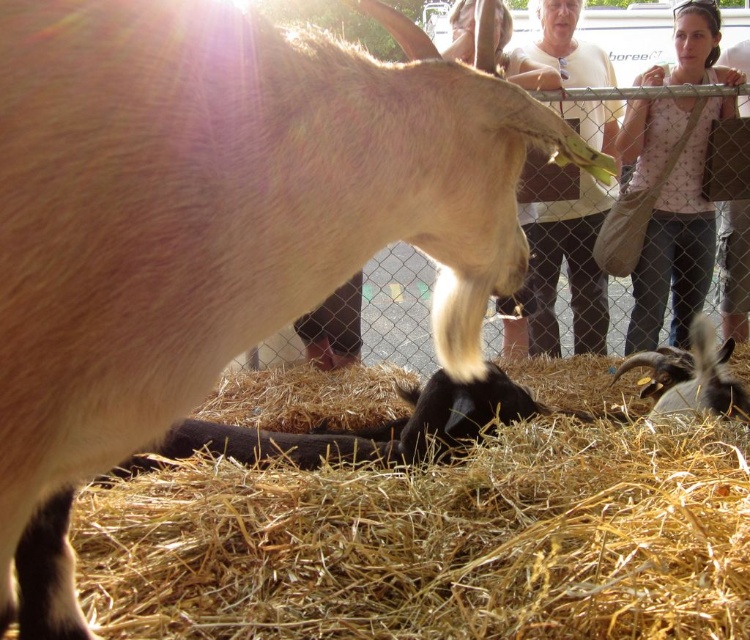
Measure the distance between point (657, 326) and camera.

A distance of 12.43 feet exists between point (657, 326) and camera.

Who is positioned more to the left, pink dotted shirt at upper right or light beige sweater at upper center?

From the viewer's perspective, light beige sweater at upper center appears more on the left side.

At what (x,y) coordinates should I click in order to perform the action: click on pink dotted shirt at upper right. Please return your answer as a coordinate pair (x, y). This screenshot has height=640, width=750. Looking at the image, I should click on (678, 243).

Which is above, golden straw at lower center or black fuzzy goat at lower right?

Positioned higher is black fuzzy goat at lower right.

Is golden straw at lower center closer to camera compared to black fuzzy goat at lower right?

Yes, it is.

Between point (180, 518) and point (711, 394), which one is positioned behind?

The point (711, 394) is more distant.

Where is `golden straw at lower center`? The height and width of the screenshot is (640, 750). golden straw at lower center is located at coordinates (435, 541).

Which of these two, light beige sweater at upper center or black fuzzy goat at lower right, stands shorter?

Standing shorter between the two is black fuzzy goat at lower right.

Who is lower down, light beige sweater at upper center or black fuzzy goat at lower right?

black fuzzy goat at lower right is below.

Is point (594, 145) positioned behind point (690, 337)?

No.

This screenshot has height=640, width=750. I want to click on light beige sweater at upper center, so click(x=560, y=266).